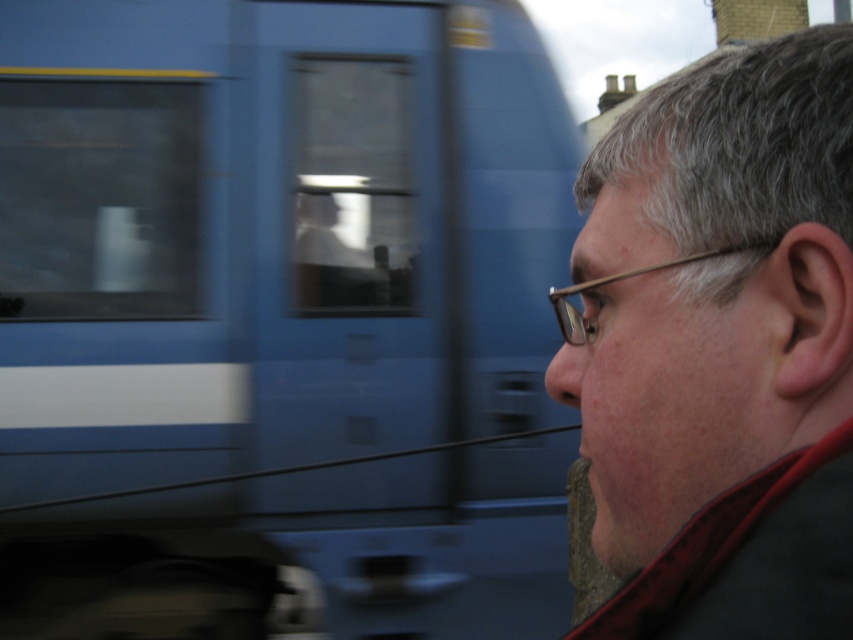
You are a photographer trying to capture the blue glossy train at upper left in the image. You notice a point marked at coordinates point (280, 320). Where exactly should you focus your camera to ensure the blue glossy train at upper left is in sharp focus?

The point (280, 320) marks the location of the blue glossy train at upper left, so you should focus your camera precisely at the coordinates point (280, 320) to ensure the blue glossy train at upper left is in sharp focus.

You are standing in a station and see the blue glossy train at upper left approaching. The safety line is 4 meters away from where you are standing. Should you step back to avoid the train?

The blue glossy train at upper left is 4.19 meters away from viewer, which is beyond the safety line of 4 meters. Therefore, you are already behind the safety line and do not need to step back further.

You are standing in front of the person in the image and want to place two stickers on the points labeled as point (389,12) and point (671,266). According to the scene, which point should you place the sticker closer to the person?

Point (671,266) should be placed closer to the person because it is in front of point (389,12).